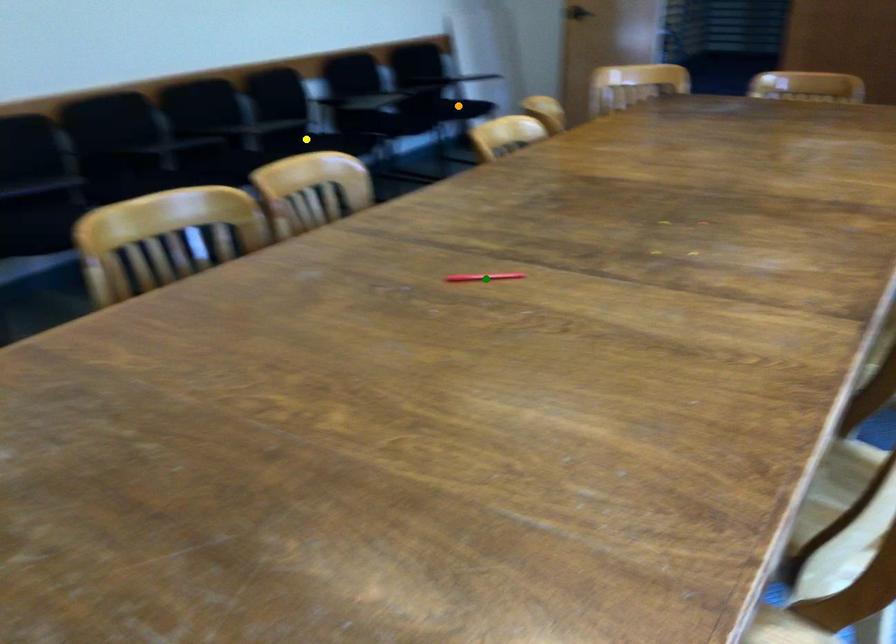
Order these from nearest to farthest:
- orange point
- green point
- yellow point

1. green point
2. yellow point
3. orange point